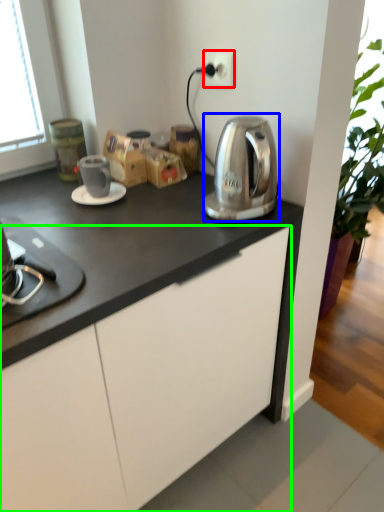
Question: Which is nearer to the electric outlet (highlighted by a red box)? kitchen appliance (highlighted by a blue box) or cabinetry (highlighted by a green box).

Choices:
 (A) kitchen appliance
 (B) cabinetry

Answer: (A)